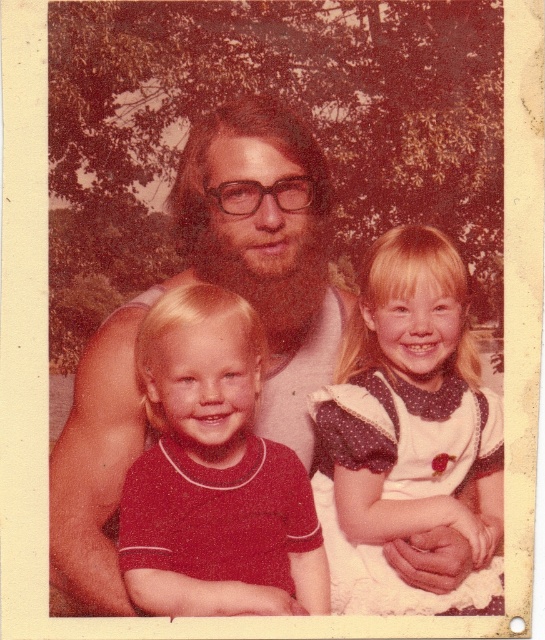
Does matte white shirt at center come behind matte red shirt at center?

Yes, matte white shirt at center is behind matte red shirt at center.

The width and height of the screenshot is (545, 640). Find the location of `matte white shirt at center`. matte white shirt at center is located at coordinates (223, 285).

Where is `matte white shirt at center`? The width and height of the screenshot is (545, 640). matte white shirt at center is located at coordinates (223, 285).

In the scene shown: Can you confirm if matte white shirt at center is positioned below white dotted dress at center?

No, matte white shirt at center is not below white dotted dress at center.

Who is taller, matte white shirt at center or white dotted dress at center?

Standing taller between the two is matte white shirt at center.

Does point (239, 292) lie in front of point (462, 268)?

Yes.

At what (x,y) coordinates should I click in order to perform the action: click on matte white shirt at center. Please return your answer as a coordinate pair (x, y). This screenshot has height=640, width=545. Looking at the image, I should click on (223, 285).

Can you confirm if white dotted dress at center is shorter than matte red shirt at center?

In fact, white dotted dress at center may be taller than matte red shirt at center.

Does white dotted dress at center appear over matte red shirt at center?

Indeed, white dotted dress at center is positioned over matte red shirt at center.

The image size is (545, 640). Find the location of `white dotted dress at center`. white dotted dress at center is located at coordinates (408, 429).